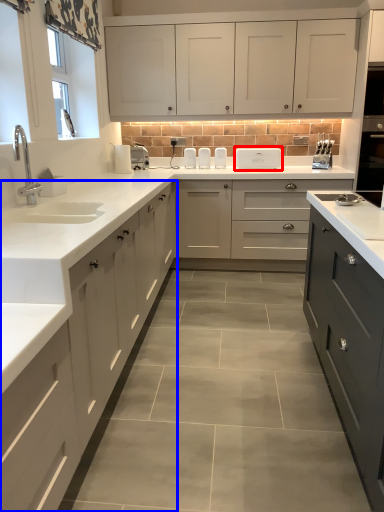
Question: Which object appears closest to the camera in this image, appliance (highlighted by a red box) or cabinetry (highlighted by a blue box)?

Choices:
 (A) appliance
 (B) cabinetry

Answer: (B)